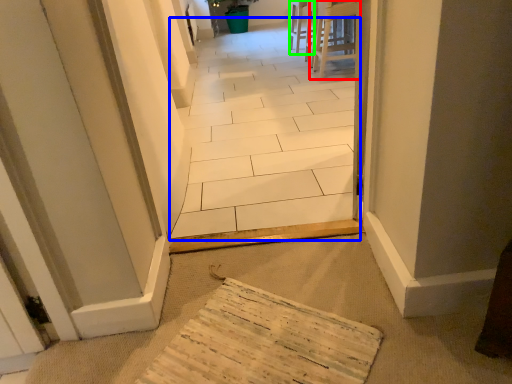
Question: Estimate the real-world distances between objects in this image. Which object is farther from furniture (highlighted by a red box), path (highlighted by a blue box) or chair (highlighted by a green box)?

Choices:
 (A) path
 (B) chair

Answer: (A)